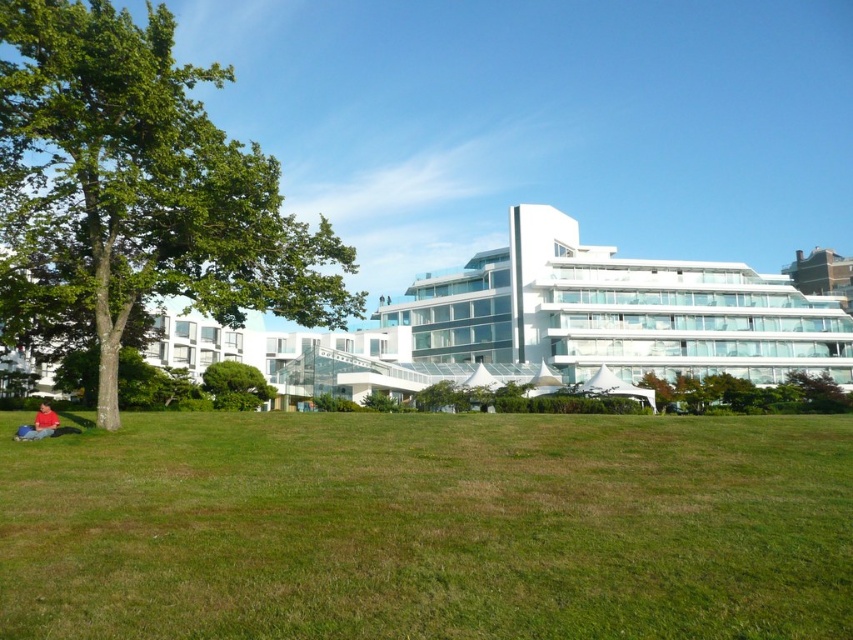
You are standing at the edge of the green grassy field at lower center and want to take a photo of the white glass building at center. Since the grass is in front of the building, will you need to move forward or backward to get a clear shot of the building without the grass in the frame?

The green grassy field at lower center is in front of the white glass building at center, so you will need to move backward to get a clear shot of the building without the grass in the frame.

You are standing at the edge of the grassy area and see the green leafy tree at center and the red cotton shirt at lower left. Which object is closer to your right side?

The green leafy tree at center is to the right of the red cotton shirt at lower left, so if you are facing the scene, the green leafy tree at center would be closer to your right side.